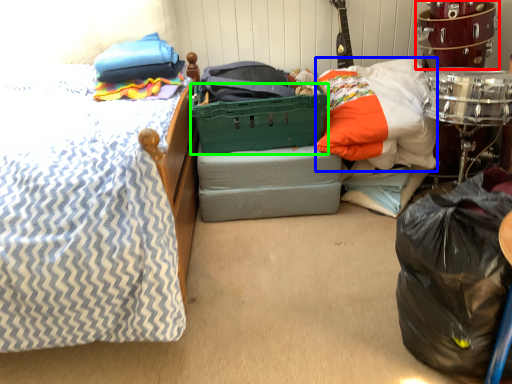
Question: Based on their relative distances, which object is farther from drum (highlighted by a red box)? Choose from pillow (highlighted by a blue box) and basket (highlighted by a green box).

Choices:
 (A) pillow
 (B) basket

Answer: (B)